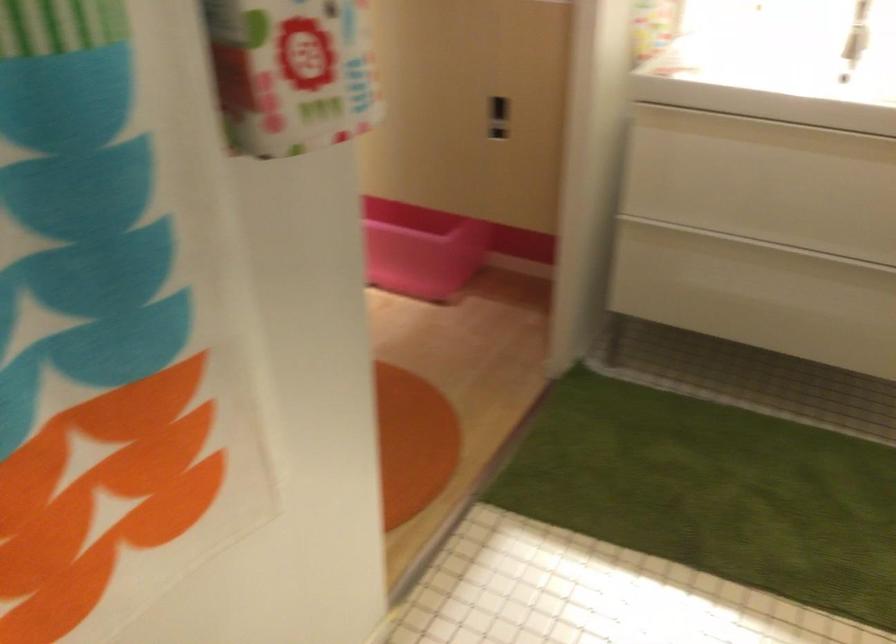
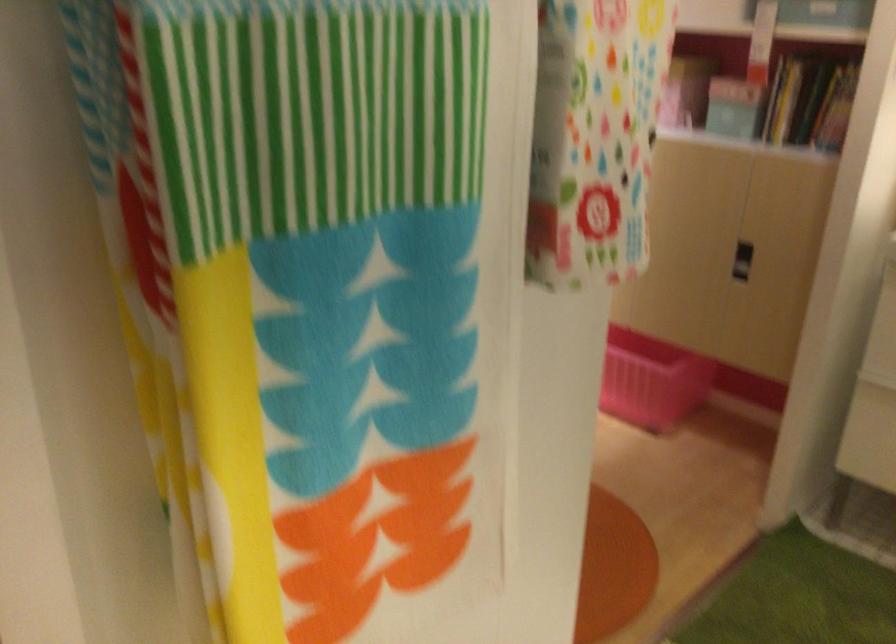
Question: What movement of the cameraman would produce the second image?

Choices:
 (A) Left
 (B) Right
 (C) Forward
 (D) Backward

Answer: (D)